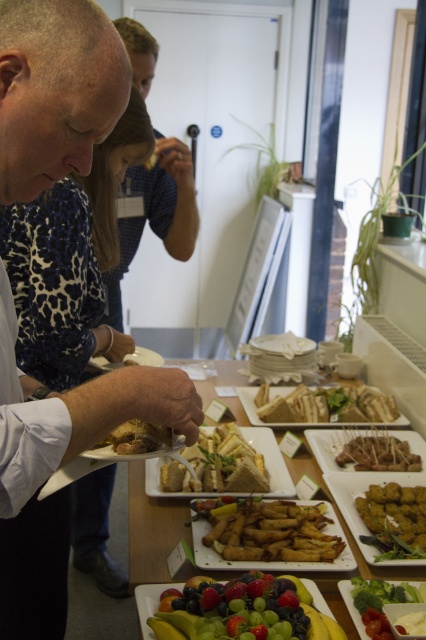
Does glossy plastic platter at lower center have a smaller size compared to matte wooden table at center?

Yes.

Between point (271, 593) and point (134, 582), which one is positioned in front?

Positioned in front is point (271, 593).

Image resolution: width=426 pixels, height=640 pixels. Find the location of `glossy plastic platter at lower center`. glossy plastic platter at lower center is located at coordinates (241, 611).

Measure the distance between point (359, 460) and camera.

A distance of 5.46 feet exists between point (359, 460) and camera.

Which is above, brown crispy skewers at center or matte brown bread at center?

matte brown bread at center is higher up.

Where is `brown crispy skewers at center`? brown crispy skewers at center is located at coordinates (379, 454).

Where is `brown crispy skewers at center`? brown crispy skewers at center is located at coordinates (379, 454).

You are a GUI agent. You are given a task and a screenshot of the screen. Output one action in this format:
    pyautogui.click(x=<x>, y=<y>)
    Task: Click on the white matte shirt at center
    This screenshot has height=640, width=426.
    Given the screenshot: What is the action you would take?
    pyautogui.click(x=57, y=467)

Is white matte shirt at center below matte wooden table at center?

No.

This screenshot has width=426, height=640. What do you see at coordinates (57, 467) in the screenshot?
I see `white matte shirt at center` at bounding box center [57, 467].

Locate an element on the screen. white matte shirt at center is located at coordinates (57, 467).